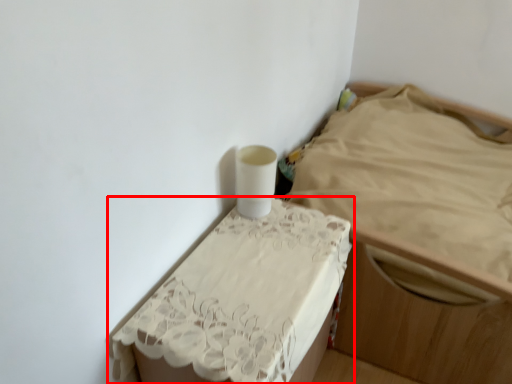
Question: Where is furniture (annotated by the red box) located in relation to furniture in the image?

Choices:
 (A) right
 (B) left

Answer: (B)